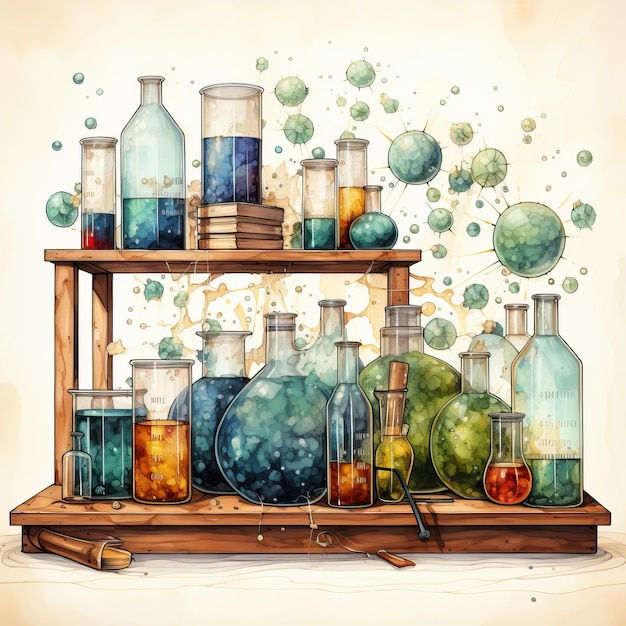
Image resolution: width=626 pixels, height=626 pixels. In order to click on bottle in this screenshot , I will do `click(553, 401)`.